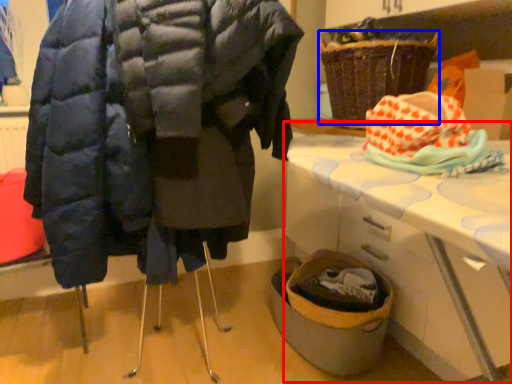
Question: Which of the following is the closest to the observer, table (highlighted by a red box) or basket (highlighted by a blue box)?

Choices:
 (A) table
 (B) basket

Answer: (A)